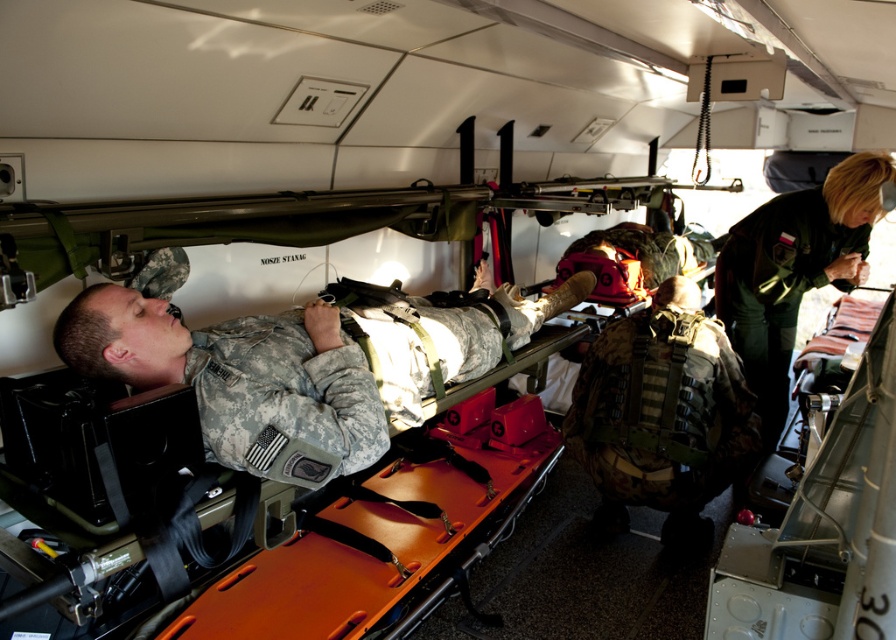
You are a military medic inside the aircraft. You need to quickly locate the camouflage fabric soldier at center. Where exactly is the soldier positioned in the aircraft?

The camouflage fabric soldier at center is positioned at point 0.592 in the x coordinate and 0.290 in the y coordinate.

You are a medic on the evacuation aircraft. You need to quickly access the medical supplies stored in the red boxes. The camo fabric vest at center and the green uniform at center are in your way. Which item should you move to create more space?

You should move the camo fabric vest at center because it might be wider than the green uniform at center, allowing for more space to access the red boxes.

You are a medic on a military evacuation aircraft and need to retrieve both the camo fabric vest at center and the green uniform at center for a patient. The aircraft has limited space, and you have a storage bag that can only hold items within a 25 inch radius. Can you carry both items in one trip without exceeding the bag capacity?

The camo fabric vest at center and green uniform at center are 24.95 inches apart, so yes, you can carry both items in one trip since the distance between them is within the 25 inch radius of the storage bag.